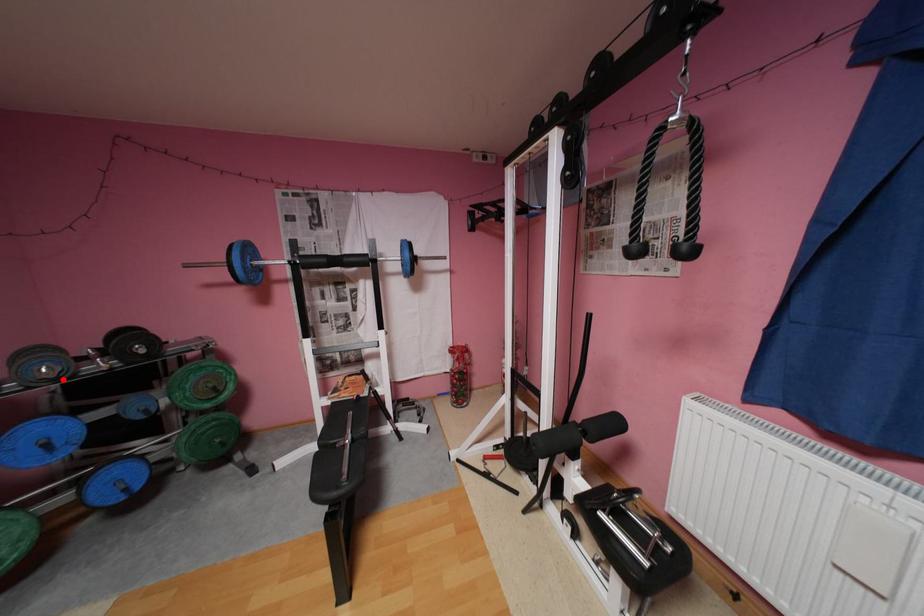
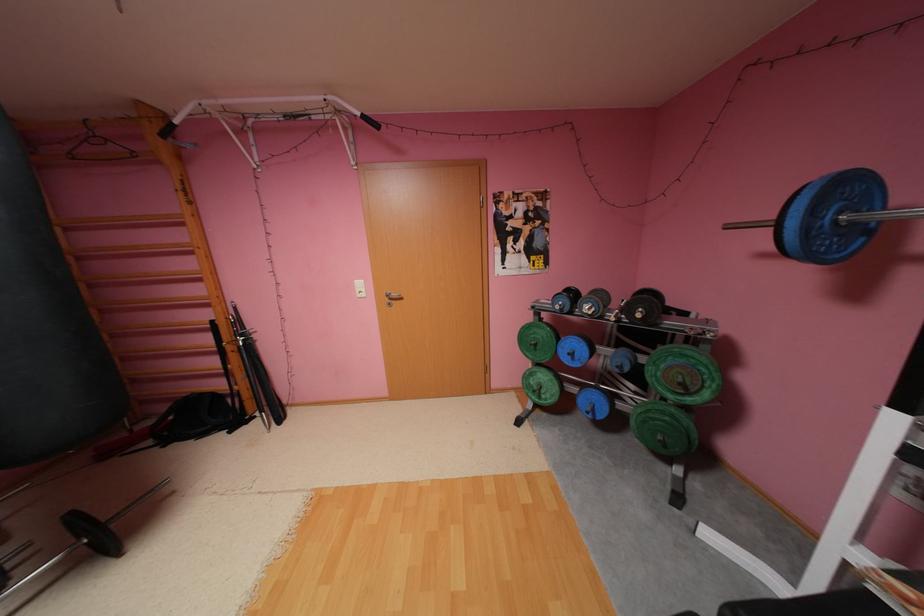
Question: I am providing you with two images of the same scene from different viewpoints. A red point is marked on the first image. Is the red point's position out of view in image 2?

Choices:
 (A) Yes
 (B) No

Answer: (B)